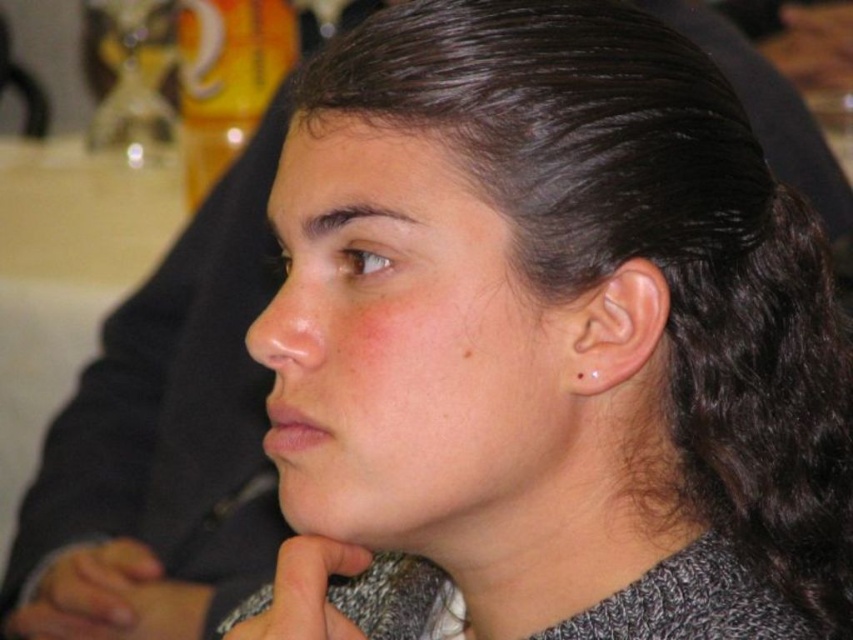
You are an artist trying to sketch the person in the image. The gray knitted sweater at lower left is represented by point (x=91, y=595). Where is the gray knitted sweater located in relation to the person?

The gray knitted sweater at lower left is located at point (x=91, y=595), which is the lower left area of the image.

You are an assistant organizing a photo shoot and need to adjust the placement of the gray knitted sweater at lower left and the gray knitted sweater at lower center. Based on the image, which sweater is positioned lower in the frame?

The gray knitted sweater at lower left is positioned below the gray knitted sweater at lower center, so it is lower in the frame.

You are a photographer standing 2 meters away from the subject in the image. You want to take a closer photo of the point at coordinates point (151, 584). How much closer do you need to move to ensure that the point becomes the main focus of your photo?

The point (151, 584) is currently 1.64 meters away from the camera. Since you are standing 2 meters away, you need to move 0.36 meters closer to reach the point.